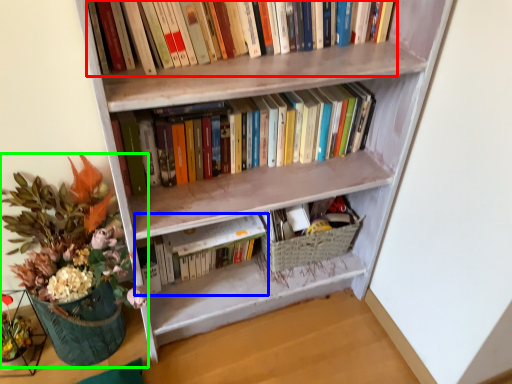
Question: Which object is positioned farthest from book (highlighted by a red box)? Select from book (highlighted by a blue box) and houseplant (highlighted by a green box).

Choices:
 (A) book
 (B) houseplant

Answer: (B)